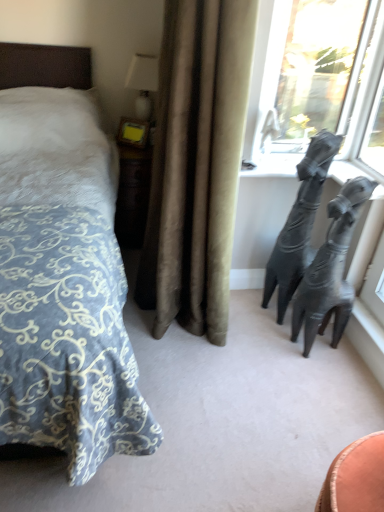
This screenshot has width=384, height=512. Find the location of `free space that is to the left of black matte giraffe at right`. free space that is to the left of black matte giraffe at right is located at coordinates coord(246,315).